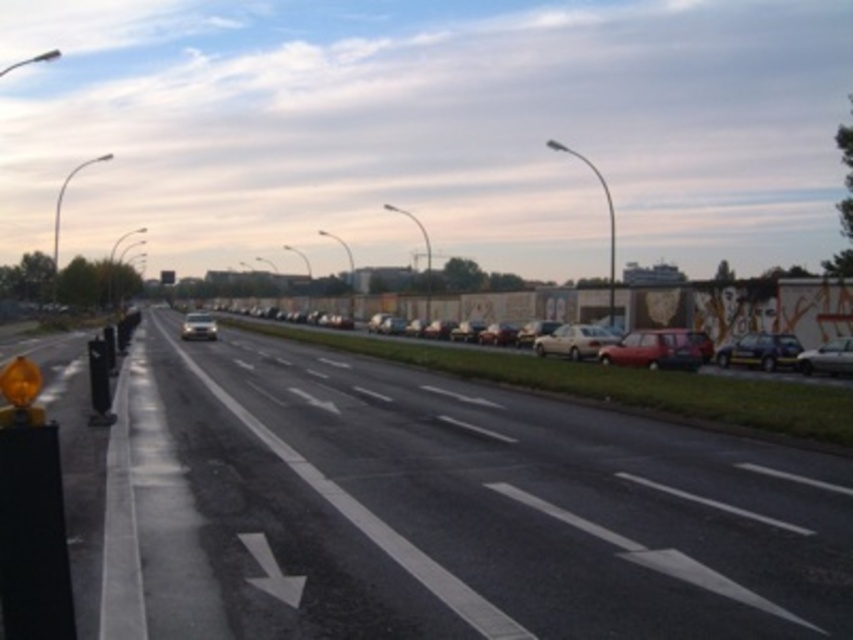
You are a pedestrian standing on the sidewalk next to the black asphalt highway at center. You see the shiny red car at right approaching. If the car is moving at 30 km per hour, will you have enough time to safely cross the road before it reaches your current position?

The distance between the black asphalt highway at center and the shiny red car at right is 14.65 meters. At 30 km per hour, the car travels approximately 8.33 meters per second. It would take about 1.76 seconds to cover the distance. Since a safe crossing requires at least 2 seconds, you have just enough time but it is very close. Proceed with caution.

You are a delivery driver who needs to ensure your truck can safely pass through the area. Given that your truck is 2.5 meters wide, can you determine if the black asphalt highway at center is wide enough to accommodate your truck based on the shiny red car at right?

The black asphalt highway at center is wider than the shiny red car at right. Since the truck is 2.5 meters wide, and the highway is wider than the car, it should be sufficient for the truck to pass safely.